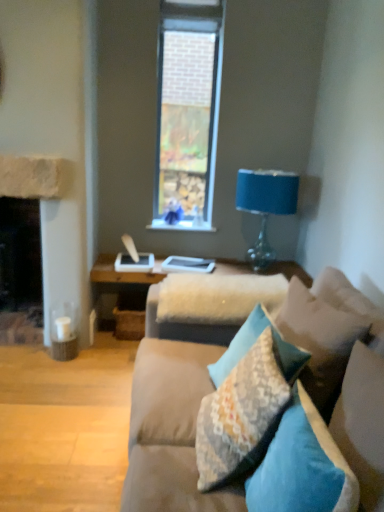
Question: From a real-world perspective, is teal fabric pillow at center, placed as the fourth pillow when sorted from back to front, located beneath textured beige pillow at lower right, arranged as the 4th pillow when viewed from the front?

Choices:
 (A) yes
 (B) no

Answer: (B)

Question: Is teal fabric pillow at center, acting as the second pillow starting from the front, to the left of textured beige pillow at lower right, which is the second pillow from back to front, from the viewer's perspective?

Choices:
 (A) no
 (B) yes

Answer: (A)

Question: Can you confirm if teal fabric pillow at center, placed as the fourth pillow when sorted from back to front, is taller than textured beige pillow at lower right, arranged as the 4th pillow when viewed from the front?

Choices:
 (A) yes
 (B) no

Answer: (B)

Question: Is teal fabric pillow at center, placed as the fourth pillow when sorted from back to front, positioned beyond the bounds of textured beige pillow at lower right, which is the second pillow from back to front?

Choices:
 (A) yes
 (B) no

Answer: (A)

Question: Considering the relative sizes of teal fabric pillow at center, acting as the second pillow starting from the front, and textured beige pillow at lower right, which is the second pillow from back to front, in the image provided, is teal fabric pillow at center, acting as the second pillow starting from the front, smaller than textured beige pillow at lower right, which is the second pillow from back to front,?

Choices:
 (A) no
 (B) yes

Answer: (B)

Question: In terms of height, does teal fabric pillow at center, placed as the fourth pillow when sorted from back to front, look taller or shorter compared to blue fabric-covered lamp at upper right?

Choices:
 (A) short
 (B) tall

Answer: (A)

Question: From the image's perspective, is teal fabric pillow at center, acting as the second pillow starting from the front, above or below blue fabric-covered lamp at upper right?

Choices:
 (A) below
 (B) above

Answer: (A)

Question: Is teal fabric pillow at center, placed as the fourth pillow when sorted from back to front, wider or thinner than blue fabric-covered lamp at upper right?

Choices:
 (A) thin
 (B) wide

Answer: (A)

Question: Is teal fabric pillow at center, acting as the second pillow starting from the front, to the left or to the right of blue fabric-covered lamp at upper right in the image?

Choices:
 (A) right
 (B) left

Answer: (B)

Question: Is point (302, 360) positioned closer to the camera than point (94, 301)?

Choices:
 (A) farther
 (B) closer

Answer: (B)

Question: In the image, is textured floral pillow at center, placed as the 1th pillow when sorted from back to front, on the left side or the right side of fuzzy fabric table at center?

Choices:
 (A) right
 (B) left

Answer: (A)

Question: From the image's perspective, is textured floral pillow at center, placed as the 1th pillow when sorted from back to front, located above or below fuzzy fabric table at center?

Choices:
 (A) below
 (B) above

Answer: (A)

Question: Considering the positions of textured floral pillow at center, the fifth pillow positioned from the front, and fuzzy fabric table at center in the image, is textured floral pillow at center, the fifth pillow positioned from the front, wider or thinner than fuzzy fabric table at center?

Choices:
 (A) thin
 (B) wide

Answer: (A)

Question: Does point [218, 453] appear closer or farther from the camera than point [319, 367]?

Choices:
 (A) closer
 (B) farther

Answer: (A)

Question: Considering the positions of textured cotton pillow at center, which is the 3th pillow from front to back, and textured beige pillow at lower right, which is the second pillow from back to front, in the image, is textured cotton pillow at center, which is the 3th pillow from front to back, taller or shorter than textured beige pillow at lower right, which is the second pillow from back to front,?

Choices:
 (A) short
 (B) tall

Answer: (A)